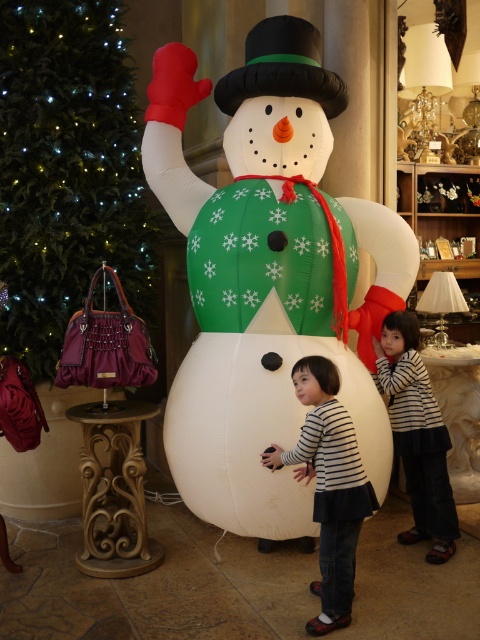
Question: Is inflatable white snowman at center smaller than green fabric christmas tree at upper left?

Choices:
 (A) no
 (B) yes

Answer: (A)

Question: Is green fabric christmas tree at upper left thinner than striped cotton shirt at center?

Choices:
 (A) yes
 (B) no

Answer: (B)

Question: Which object is closer to the camera taking this photo?

Choices:
 (A) striped cotton shirt at center
 (B) striped fabric shirt at center
 (C) inflatable white snowman at center
 (D) green fabric christmas tree at upper left

Answer: (A)

Question: Which of these objects is positioned closest to the striped cotton shirt at center?

Choices:
 (A) green fabric christmas tree at upper left
 (B) striped fabric shirt at center

Answer: (B)

Question: Observing the image, what is the correct spatial positioning of striped cotton shirt at center in reference to striped fabric shirt at center?

Choices:
 (A) below
 (B) above

Answer: (A)

Question: Which is nearer to the green fabric christmas tree at upper left?

Choices:
 (A) striped cotton shirt at center
 (B) striped fabric shirt at center

Answer: (A)